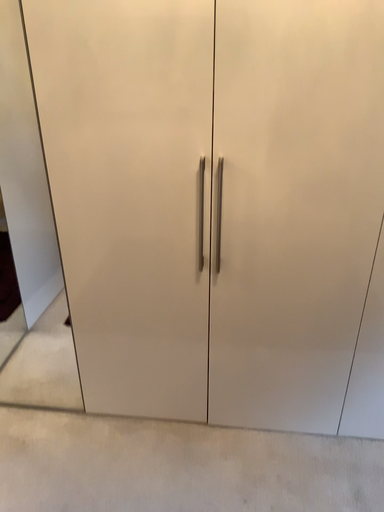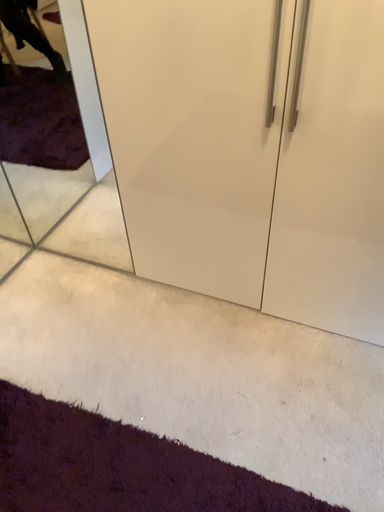
Question: Which way did the camera rotate in the video?

Choices:
 (A) rotated upward
 (B) rotated downward

Answer: (B)